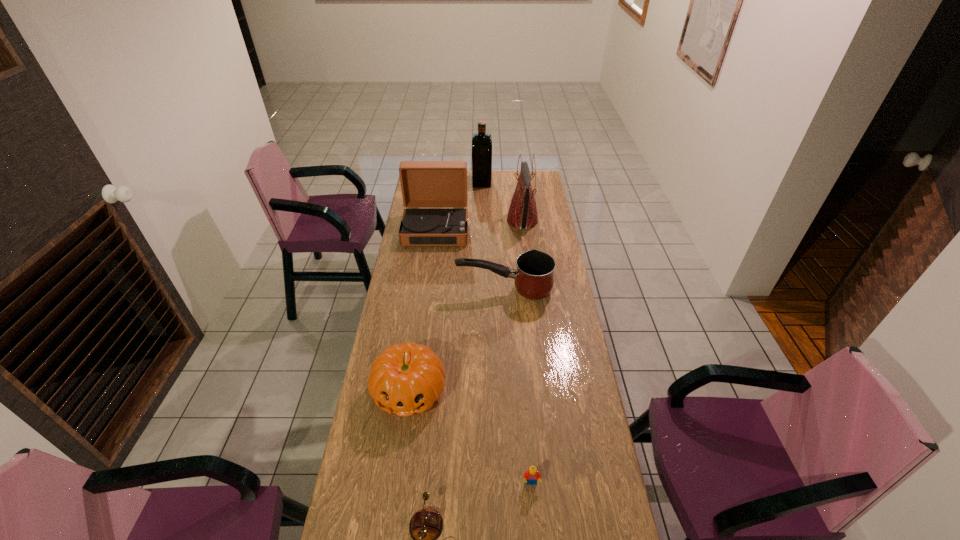
Find the location of a particular element. The height and width of the screenshot is (540, 960). vacant space located 0.300m on the face of the phonograph record is located at coordinates (428, 291).

I want to click on vacant area situated on the carved face of the pumpkin, so click(390, 530).

I want to click on vacant space situated 0.250m on the handle side of the saucepan, so point(399,290).

Locate an element on the screen. The image size is (960, 540). vacant space located on the handle side of the saucepan is located at coordinates (434, 290).

Find the location of a particular element. The image size is (960, 540). free spot located 0.090m on the handle side of the saucepan is located at coordinates (436, 290).

Where is `vacant space located 0.120m on the face of the second nearest object`? Image resolution: width=960 pixels, height=540 pixels. vacant space located 0.120m on the face of the second nearest object is located at coordinates (536, 532).

At what (x,y) coordinates should I click in order to perform the action: click on object located at the far edge. Please return your answer as a coordinate pair (x, y). Looking at the image, I should click on (481, 142).

Locate an element on the screen. The image size is (960, 540). phonograph record situated at the left edge is located at coordinates (434, 193).

Identify the location of pumpkin that is at the left edge. (407, 378).

Find the location of `handbag located at the right edge`. handbag located at the right edge is located at coordinates (522, 213).